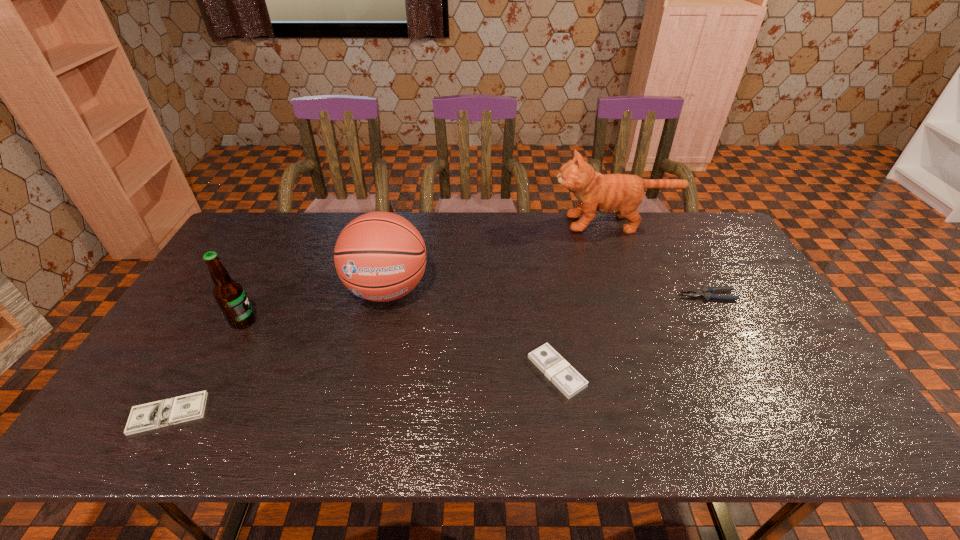
Where is `vacant region located 0.070m on the face of the farthest object`? vacant region located 0.070m on the face of the farthest object is located at coordinates (533, 223).

Identify the location of free space located on the logo side of the fourth object from right to left. This screenshot has height=540, width=960. (354, 437).

Locate an element on the screen. This screenshot has height=540, width=960. vacant region located 0.060m on the label of the beer bottle is located at coordinates (277, 321).

What are the coordinates of `vacant region located at the gripping part of the pliers` in the screenshot? It's located at click(x=577, y=296).

The image size is (960, 540). Find the location of `vacant space located at the gripping part of the pliers`. vacant space located at the gripping part of the pliers is located at coordinates (577, 296).

Locate an element on the screen. free space located 0.240m at the gripping part of the pliers is located at coordinates (601, 296).

At what (x,y) coordinates should I click in order to perform the action: click on free region located 0.050m on the back of the taller dollar. Please return your answer as a coordinate pair (x, y). Looking at the image, I should click on (x=551, y=332).

You are a GUI agent. You are given a task and a screenshot of the screen. Output one action in this format:
    pyautogui.click(x=<x>, y=<y>)
    Task: Click on the vacant space located on the right of the shortest object
    This screenshot has width=960, height=540.
    Given the screenshot: What is the action you would take?
    pyautogui.click(x=325, y=413)

In order to click on object that is at the far edge in this screenshot , I will do `click(621, 194)`.

The image size is (960, 540). I want to click on object at the near edge, so click(157, 414).